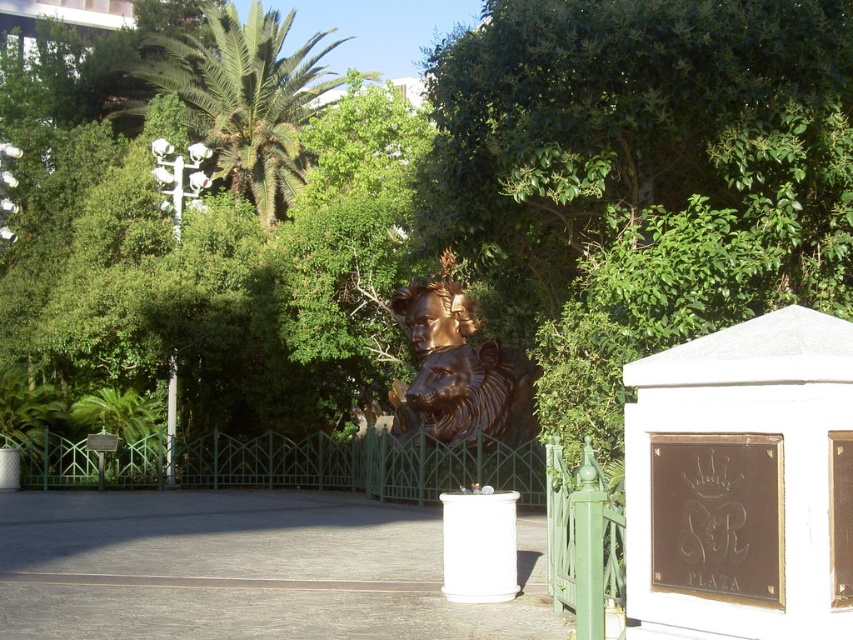
Question: Observing the image, what is the correct spatial positioning of green metal fence at center in reference to bronze/smooth lion head at center?

Choices:
 (A) right
 (B) left

Answer: (B)

Question: Which point is farther to the camera?

Choices:
 (A) (213, 99)
 (B) (396, 484)

Answer: (A)

Question: Based on their relative distances, which object is farther from the bronze/smooth lion head at center?

Choices:
 (A) green metal fence at center
 (B) green leafy palm tree at upper left

Answer: (B)

Question: In this image, where is green metal fence at center located relative to green leafy palm tree at upper left?

Choices:
 (A) right
 (B) left

Answer: (A)

Question: Does green metal fence at center come behind bronze/smooth lion head at center?

Choices:
 (A) yes
 (B) no

Answer: (B)

Question: Which object is positioned closest to the bronze/smooth lion head at center?

Choices:
 (A) green leafy palm tree at upper left
 (B) green metal fence at center

Answer: (B)